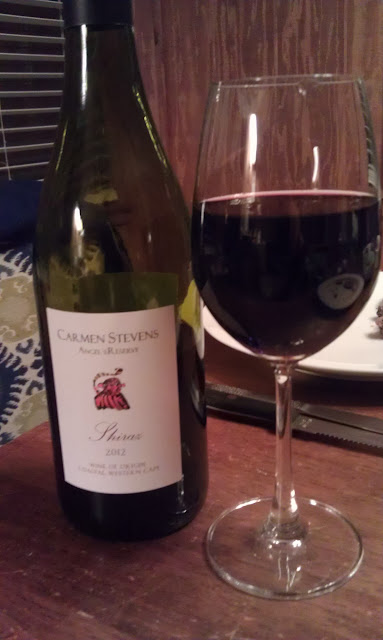
The image size is (383, 640). I want to click on wine glass, so click(x=262, y=339).